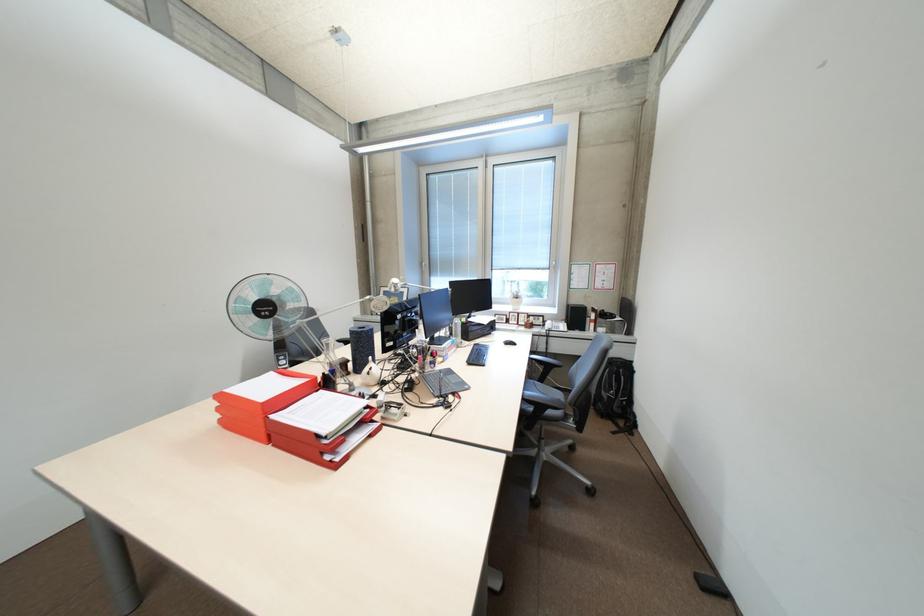
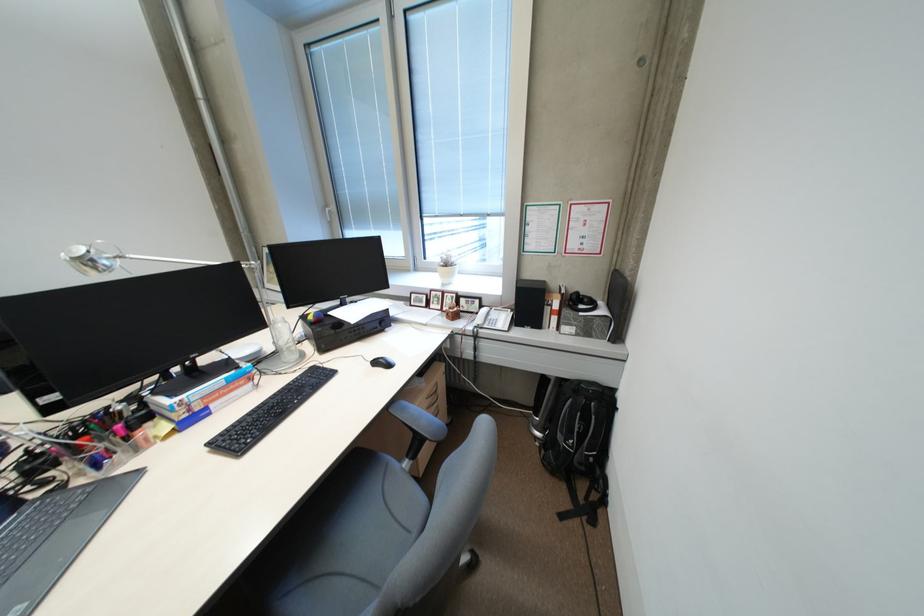
Where in the second image is the point corresponding to the point at 604,330 from the first image?

(568, 328)